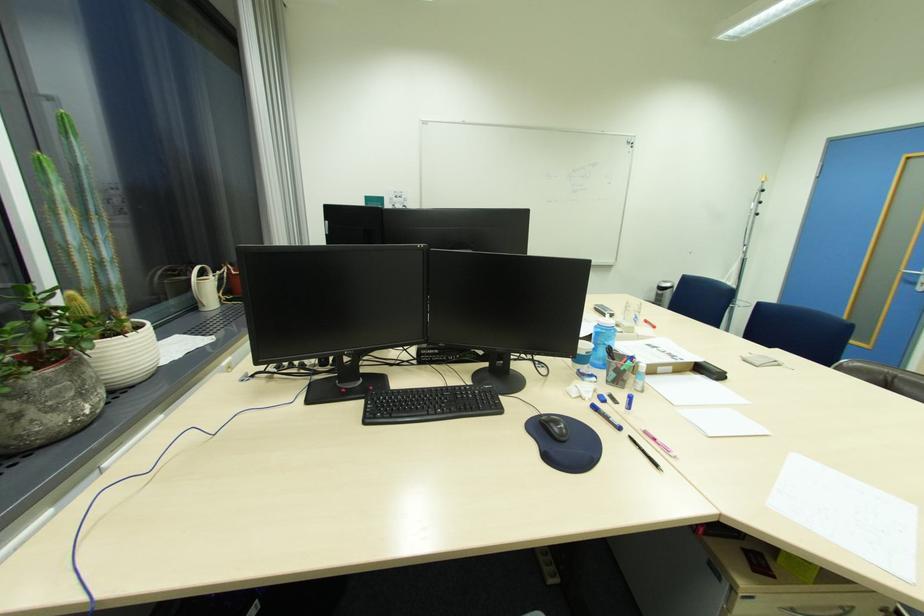
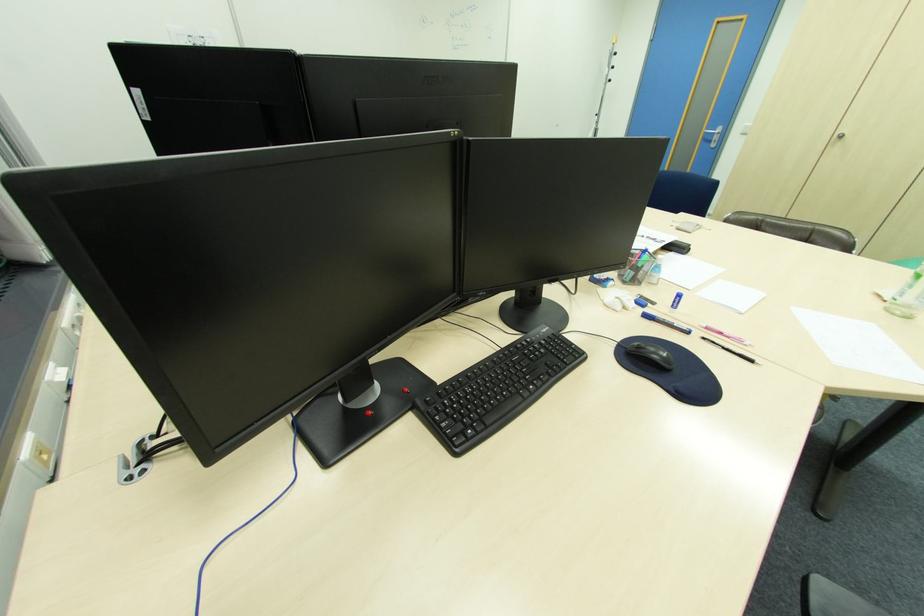
In the second image, find the point that corresponds to point (473, 387) in the first image.

(533, 339)